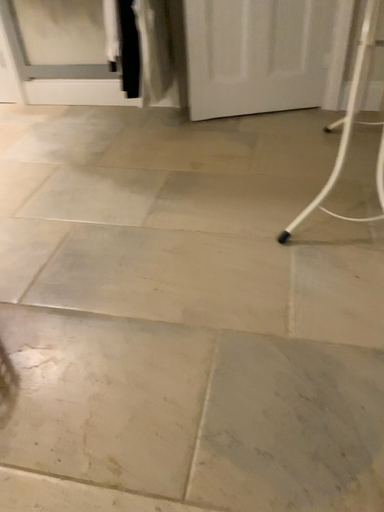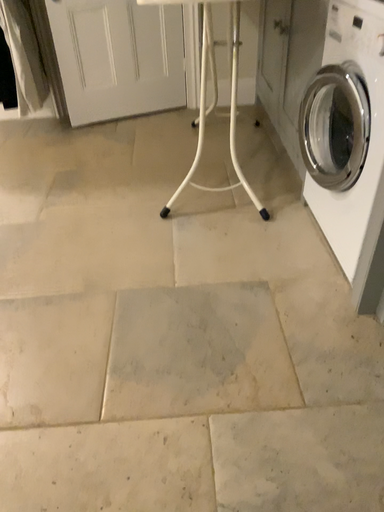
Question: How did the camera likely rotate when shooting the video?

Choices:
 (A) rotated left
 (B) rotated right

Answer: (B)